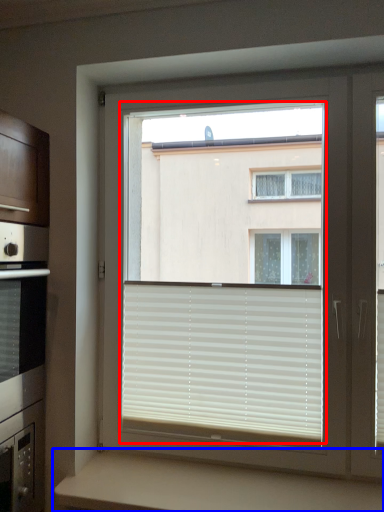
Question: Which point is further to the camera, bay window (highlighted by a red box) or counter (highlighted by a blue box)?

Choices:
 (A) bay window
 (B) counter

Answer: (A)